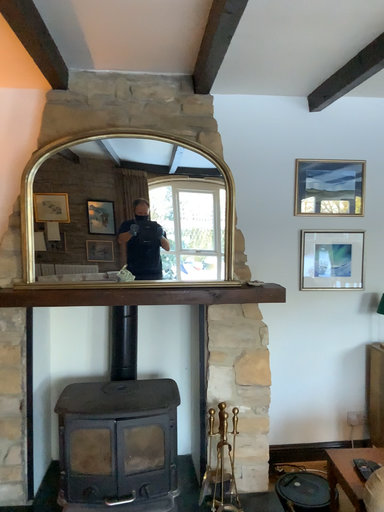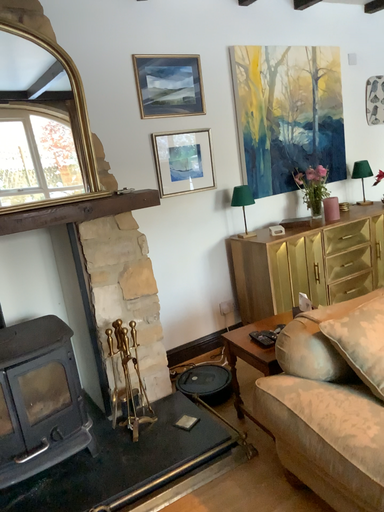
Question: How did the camera likely rotate when shooting the video?

Choices:
 (A) rotated left
 (B) rotated right

Answer: (B)